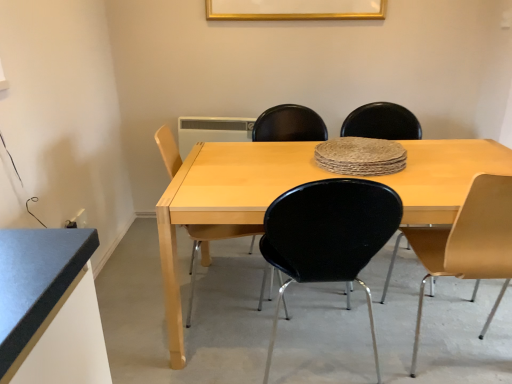
Where is `vacant space to the right of light wood/black plastic chair at center, which is the 4th chair from right to left`? The width and height of the screenshot is (512, 384). vacant space to the right of light wood/black plastic chair at center, which is the 4th chair from right to left is located at coordinates (282, 299).